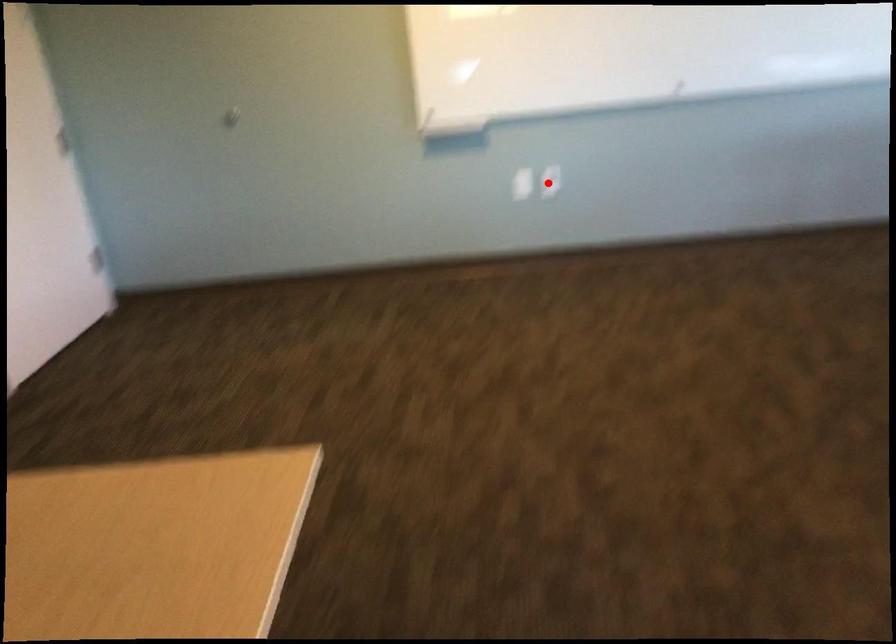
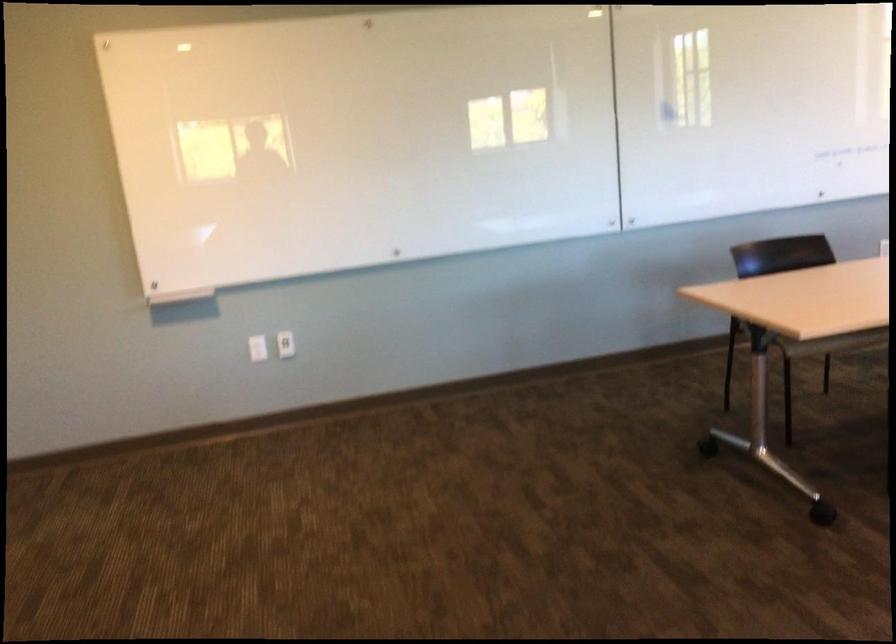
Find the pixel in the second image that matches the highlighted location in the first image.

(286, 344)